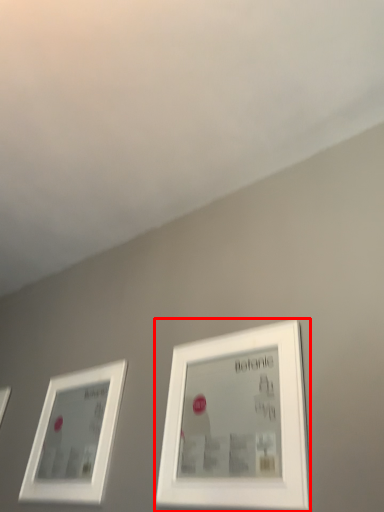
Question: From the image's perspective, considering the relative positions of picture frame (annotated by the red box) and picture frame in the image provided, where is picture frame (annotated by the red box) located with respect to the staircase?

Choices:
 (A) below
 (B) above

Answer: (B)